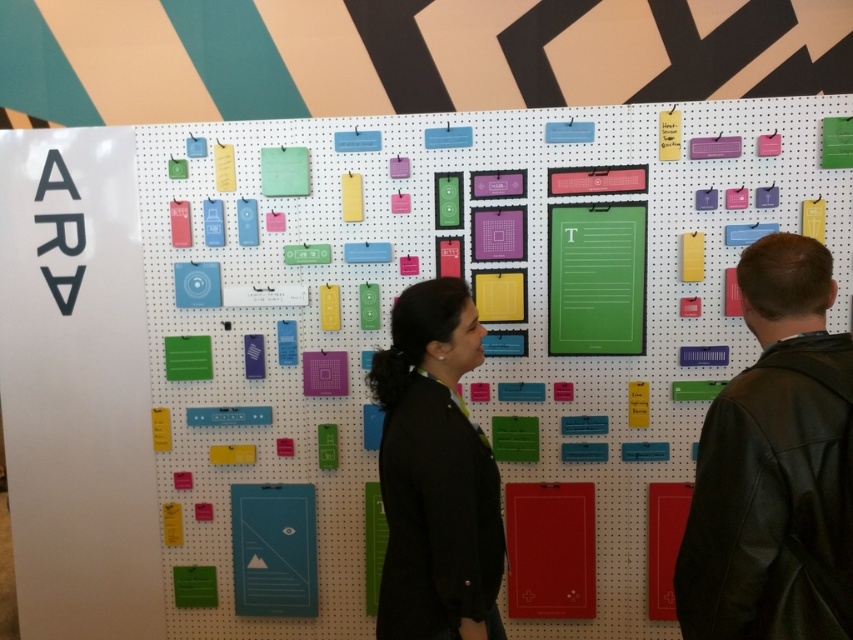
Does point (720, 609) come closer to viewer compared to point (393, 589)?

Yes, point (720, 609) is in front of point (393, 589).

The height and width of the screenshot is (640, 853). What do you see at coordinates (775, 467) in the screenshot?
I see `black leather jacket at right` at bounding box center [775, 467].

At what (x,y) coordinates should I click in order to perform the action: click on black leather jacket at right. Please return your answer as a coordinate pair (x, y). Looking at the image, I should click on (775, 467).